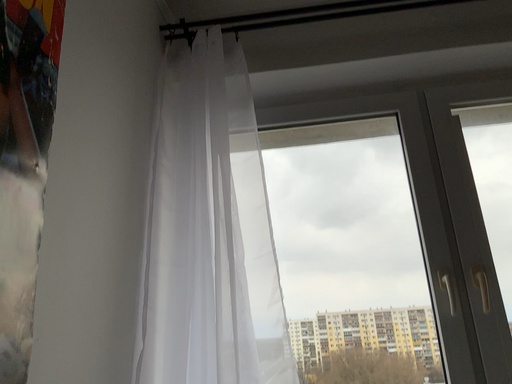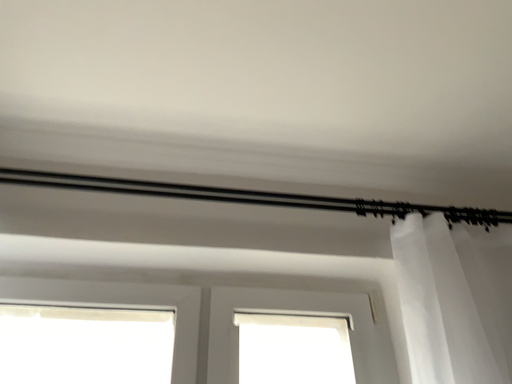
Question: How did the camera likely rotate when shooting the video?

Choices:
 (A) rotated right
 (B) rotated left

Answer: (A)